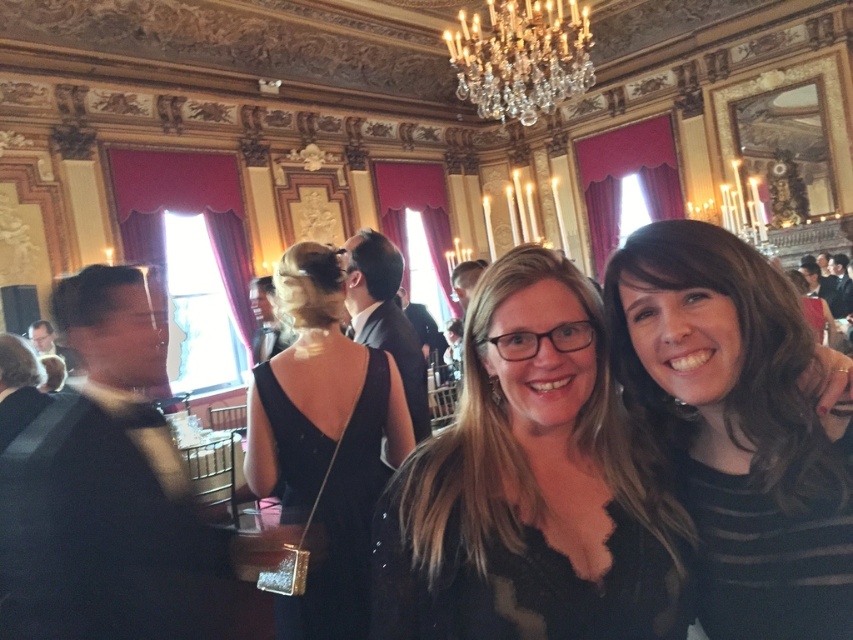
This screenshot has width=853, height=640. I want to click on black striped shirt at right, so click(x=737, y=428).

Does black striped shirt at right appear on the right side of black velvet dress at center?

Indeed, black striped shirt at right is positioned on the right side of black velvet dress at center.

Which is in front, point (715, 312) or point (329, 568)?

Point (715, 312)

Find the location of a particular element. The image size is (853, 640). black striped shirt at right is located at coordinates (737, 428).

Can you confirm if black velvet dress at center is taller than crystal glass chandelier at upper center?

Yes.

Is black velvet dress at center smaller than crystal glass chandelier at upper center?

Yes.

What do you see at coordinates (323, 442) in the screenshot?
I see `black velvet dress at center` at bounding box center [323, 442].

What are the coordinates of `black velvet dress at center` in the screenshot? It's located at (323, 442).

Image resolution: width=853 pixels, height=640 pixels. What do you see at coordinates (737, 428) in the screenshot?
I see `black striped shirt at right` at bounding box center [737, 428].

Based on the photo, does black striped shirt at right have a larger size compared to crystal glass chandelier at upper center?

Actually, black striped shirt at right might be smaller than crystal glass chandelier at upper center.

Where is `black striped shirt at right`? The image size is (853, 640). black striped shirt at right is located at coordinates (737, 428).

At what (x,y) coordinates should I click in order to perform the action: click on black striped shirt at right. Please return your answer as a coordinate pair (x, y). Image resolution: width=853 pixels, height=640 pixels. Looking at the image, I should click on click(x=737, y=428).